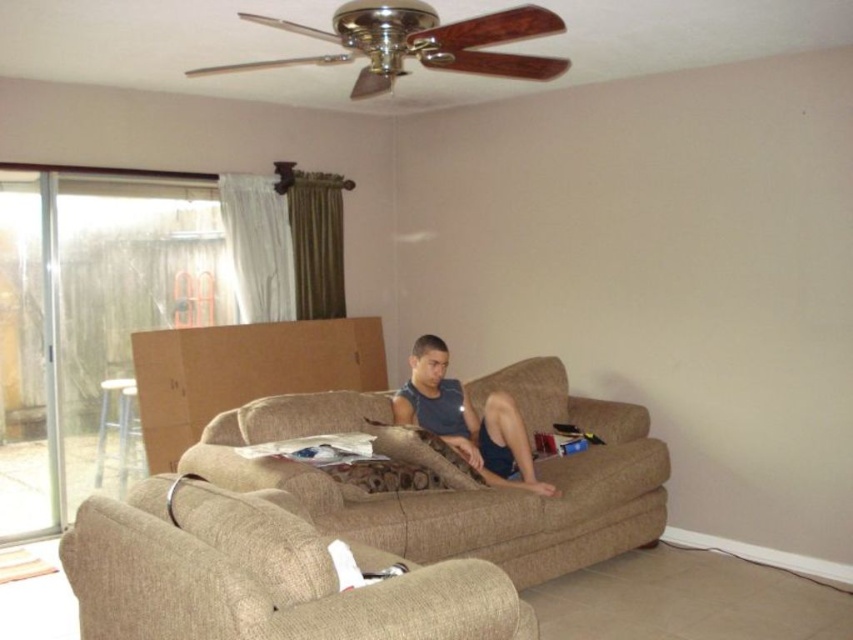
What do you see at coordinates (459, 477) in the screenshot? I see `beige fabric couch at center` at bounding box center [459, 477].

Consider the image. Between beige fabric couch at center and transparent glass screen door at left, which one has more height?

transparent glass screen door at left

The height and width of the screenshot is (640, 853). Identify the location of beige fabric couch at center. (459, 477).

Is transparent glass screen door at left bigger than matte blue tank top at center?

No, transparent glass screen door at left is not bigger than matte blue tank top at center.

Is point (54, 340) in front of point (445, 410)?

No, it is not.

Where is `transparent glass screen door at left`? transparent glass screen door at left is located at coordinates (28, 362).

Is beige fabric armchair at lower left smaller than transparent glass screen door at left?

No, beige fabric armchair at lower left is not smaller than transparent glass screen door at left.

Describe the element at coordinates (259, 577) in the screenshot. I see `beige fabric armchair at lower left` at that location.

The width and height of the screenshot is (853, 640). I want to click on beige fabric armchair at lower left, so click(x=259, y=577).